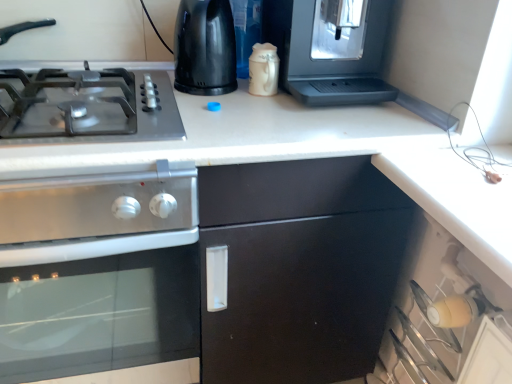
Question: Based on their sizes in the image, would you say black plastic kettle at upper center, the second appliance when ordered from right to left, is bigger or smaller than satin silver coffee machine at upper right, which is counted as the 2th appliance, starting from the left?

Choices:
 (A) small
 (B) big

Answer: (A)

Question: From the image's perspective, is black plastic kettle at upper center, the second appliance when ordered from right to left, located above or below satin silver coffee machine at upper right, which is counted as the 2th appliance, starting from the left?

Choices:
 (A) below
 (B) above

Answer: (A)

Question: Which of these objects is positioned farthest from the metallic gray gas stove at left?

Choices:
 (A) satin silver coffee machine at upper right, which is counted as the 2th appliance, starting from the left
 (B) black plastic kettle at upper center, marked as the first appliance in a left-to-right arrangement
 (C) stainless steel oven at left

Answer: (A)

Question: Which is nearer to the black plastic kettle at upper center, marked as the first appliance in a left-to-right arrangement?

Choices:
 (A) metallic gray gas stove at left
 (B) stainless steel oven at left
 (C) satin silver coffee machine at upper right, which is counted as the 2th appliance, starting from the left

Answer: (A)